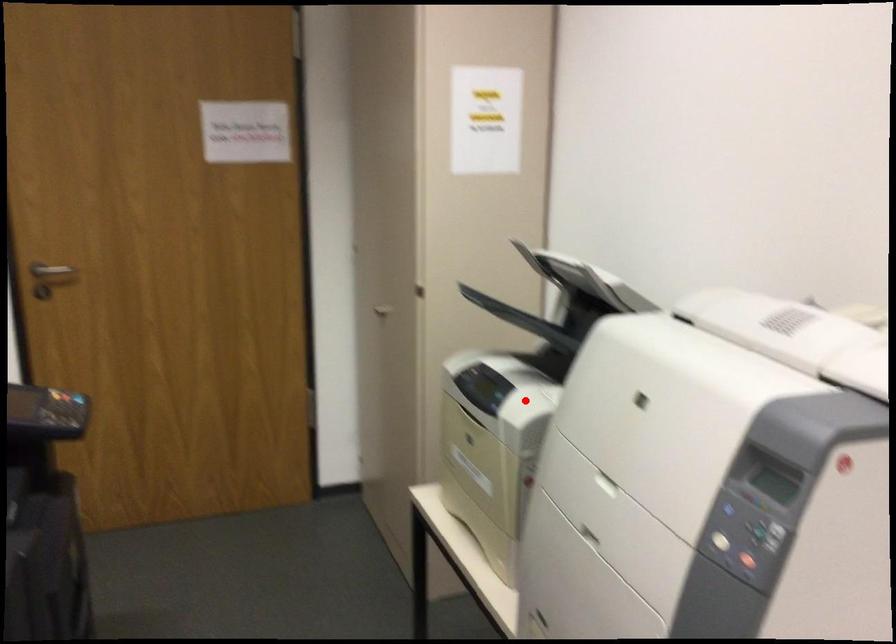
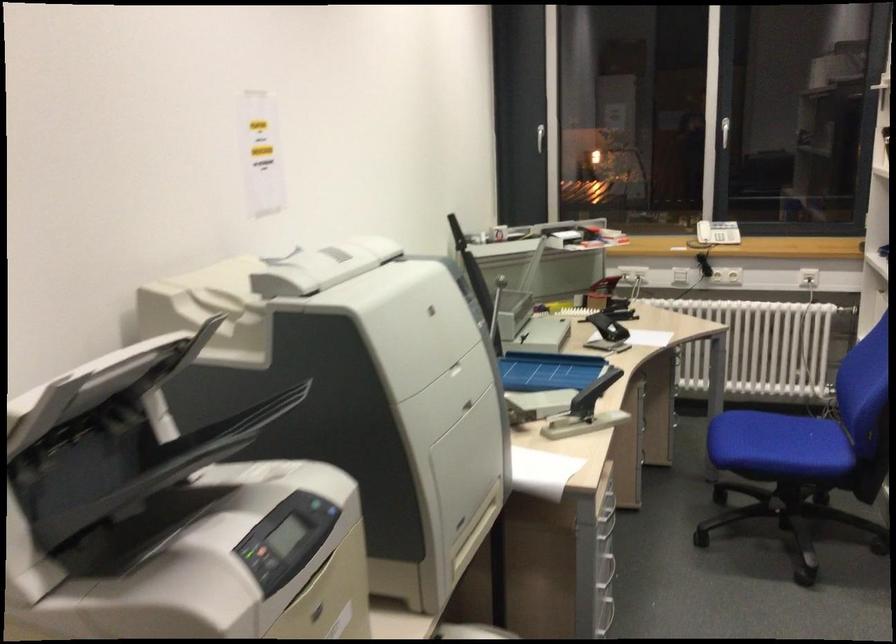
In the second image, find the point that corresponds to the highlighted location in the first image.

(278, 543)